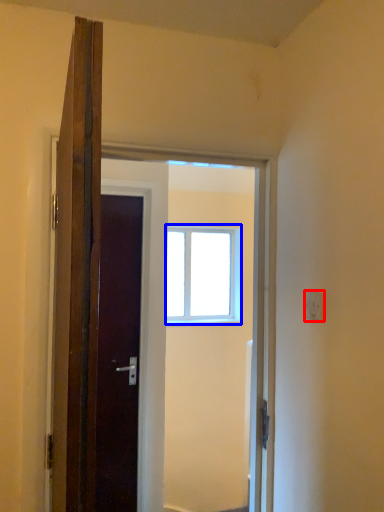
Question: Which object is further to the camera taking this photo, electric outlet (highlighted by a red box) or window (highlighted by a blue box)?

Choices:
 (A) electric outlet
 (B) window

Answer: (B)